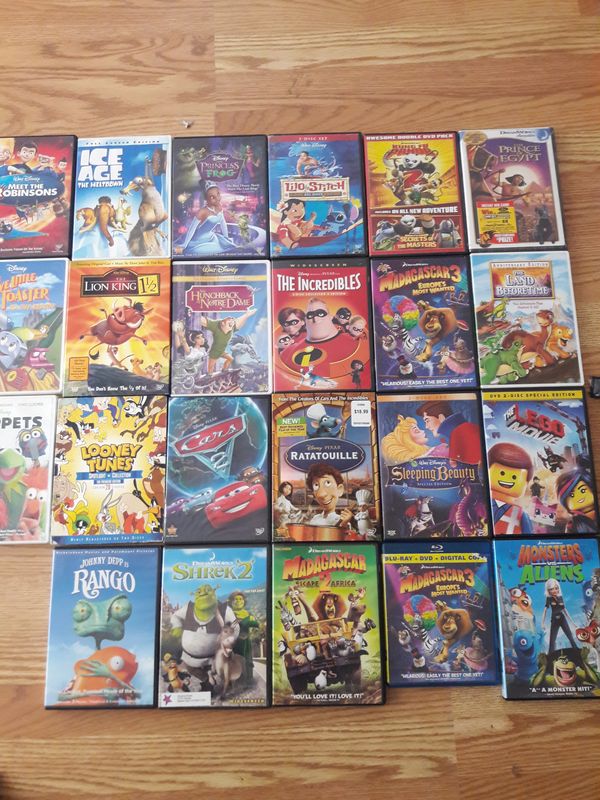
Locate an element on the screen. The height and width of the screenshot is (800, 600). dvd in bottom row is located at coordinates (539, 602), (443, 601), (321, 614), (217, 632), (127, 622).